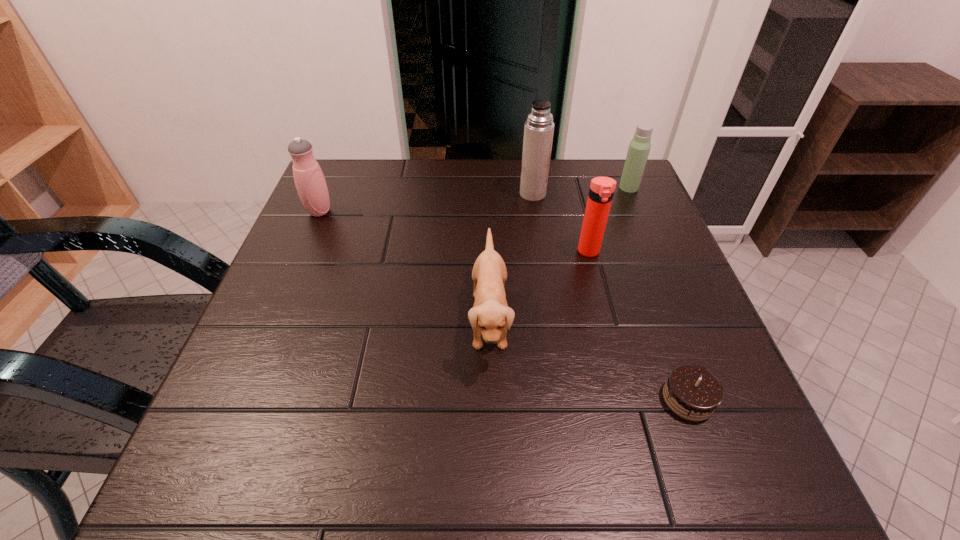
Locate an element on the screen. Image resolution: width=960 pixels, height=540 pixels. thermos bottle identified as the closest to the tallest thermos bottle is located at coordinates (601, 191).

Identify which thermos bottle is the closest to the chocolate cake. Please provide its 2D coordinates. Your answer should be formatted as a tuple, i.e. [(x, y)], where the tuple contains the x and y coordinates of a point satisfying the conditions above.

[(601, 191)]

Image resolution: width=960 pixels, height=540 pixels. Find the location of `free region that satisfies the following two spatial constraints: 1. on the left side of the shortest object; 2. on the left side of the fifth tallest object`. free region that satisfies the following two spatial constraints: 1. on the left side of the shortest object; 2. on the left side of the fifth tallest object is located at coordinates (491, 399).

Find the location of `free location that satisfies the following two spatial constraints: 1. on the front side of the shortest object; 2. on the left side of the nearest thermos bottle`. free location that satisfies the following two spatial constraints: 1. on the front side of the shortest object; 2. on the left side of the nearest thermos bottle is located at coordinates (627, 399).

Where is `vacant point that satisfies the following two spatial constraints: 1. on the back side of the third nearest object; 2. on the left side of the rightmost thermos bottle`? The height and width of the screenshot is (540, 960). vacant point that satisfies the following two spatial constraints: 1. on the back side of the third nearest object; 2. on the left side of the rightmost thermos bottle is located at coordinates (572, 187).

The width and height of the screenshot is (960, 540). I want to click on free point that satisfies the following two spatial constraints: 1. on the front side of the nearest thermos bottle; 2. on the right side of the fourth nearest object, so click(302, 252).

Locate an element on the screen. vacant space that satisfies the following two spatial constraints: 1. on the front side of the rightmost thermos bottle; 2. on the left side of the second shortest object is located at coordinates (684, 320).